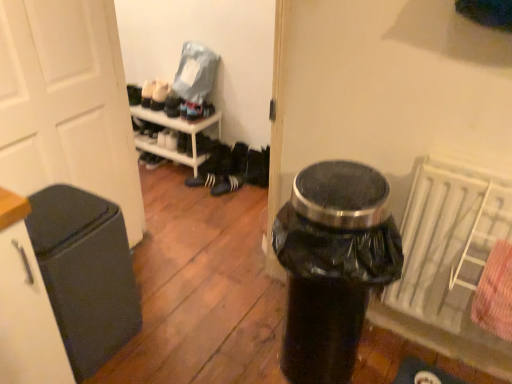
I want to click on spots to the right of black matte trash can at left, so click(x=166, y=334).